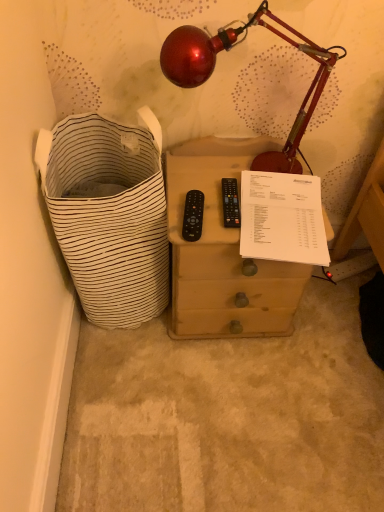
This screenshot has width=384, height=512. Find the location of `free space in front of white striped fabric laundry basket at left`. free space in front of white striped fabric laundry basket at left is located at coordinates (135, 397).